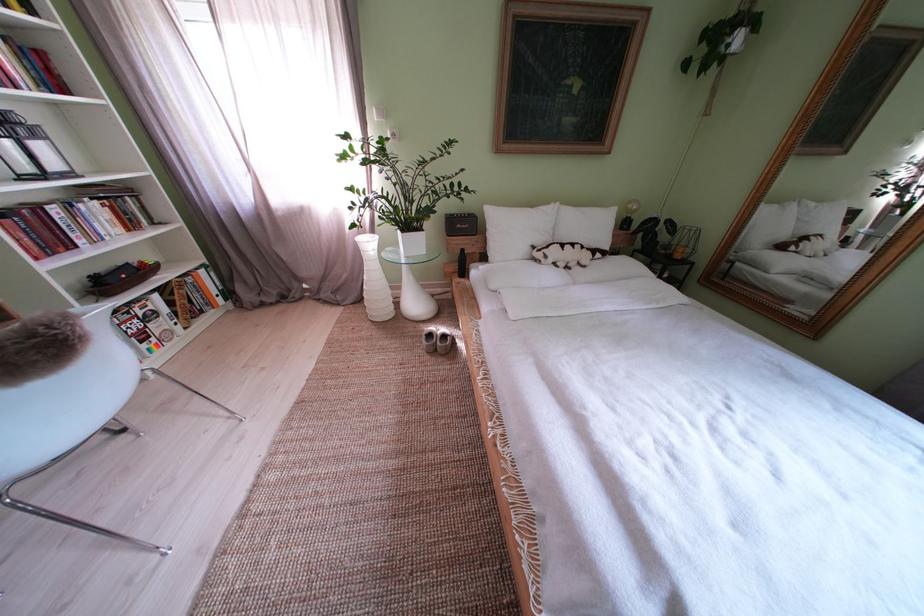
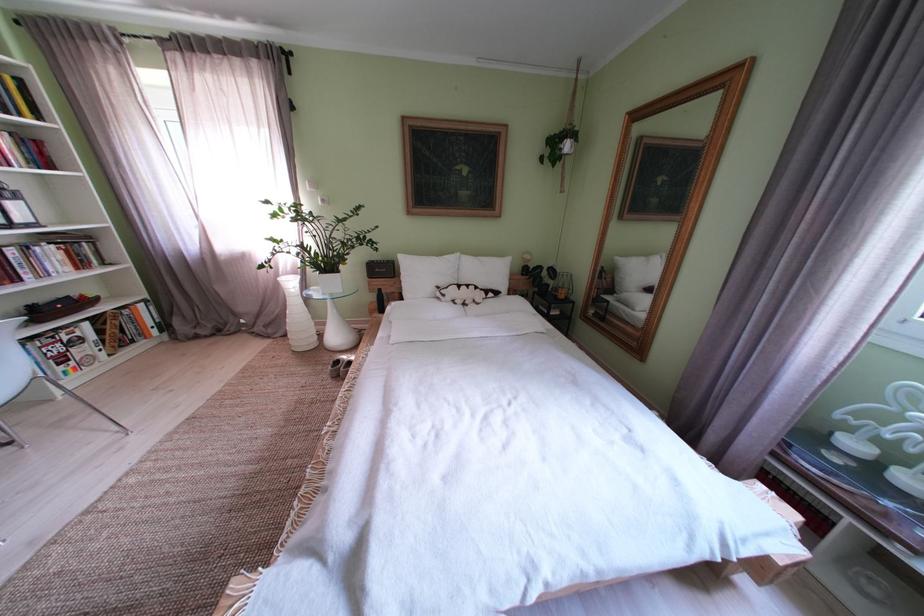
Locate, in the second image, the point that corresponds to [92,212] in the first image.

(49, 254)